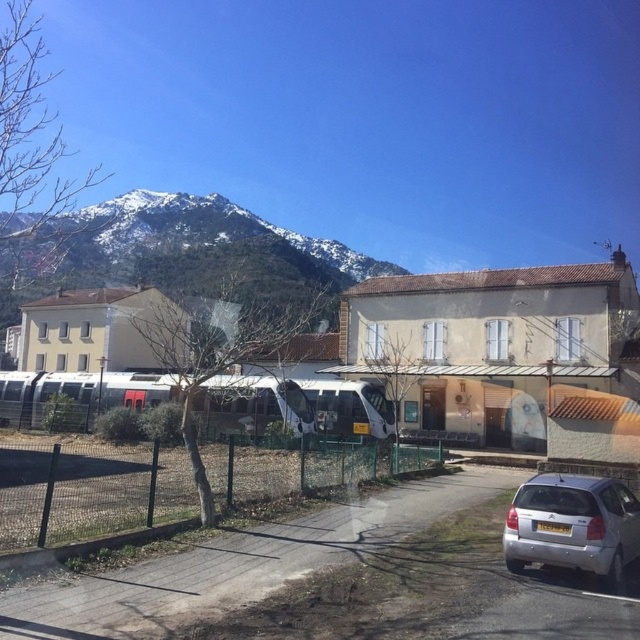
You are a photographer standing at the center of the road. You want to take a photo that includes both the snowy rock mountain at upper left and the silver metallic hatchback at lower right. Which object should you adjust your camera angle to focus on first to ensure both are in the frame?

The snowy rock mountain at upper left is positioned over the silver metallic hatchback at lower right, so you should adjust your camera angle to focus on the snowy rock mountain at upper left first to ensure both are in the frame.

Based on the photo, you are a pedestrian standing on the road and want to cross to the building with the terracotta roof. The white glossy passenger train at center and the silver metallic hatchback at lower right are in your path. Which vehicle should you avoid first?

The white glossy passenger train at center is located below the silver metallic hatchback at lower right, so you should avoid the silver metallic hatchback at lower right first as it is closer to your path.